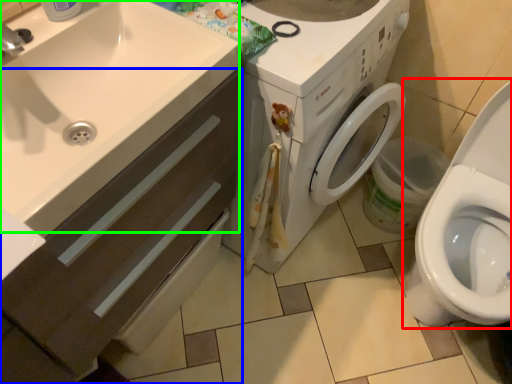
Question: Estimate the real-world distances between objects in this image. Which object is closer to toilet (highlighted by a red box), bathroom cabinet (highlighted by a blue box) or sink (highlighted by a green box)?

Choices:
 (A) bathroom cabinet
 (B) sink

Answer: (A)